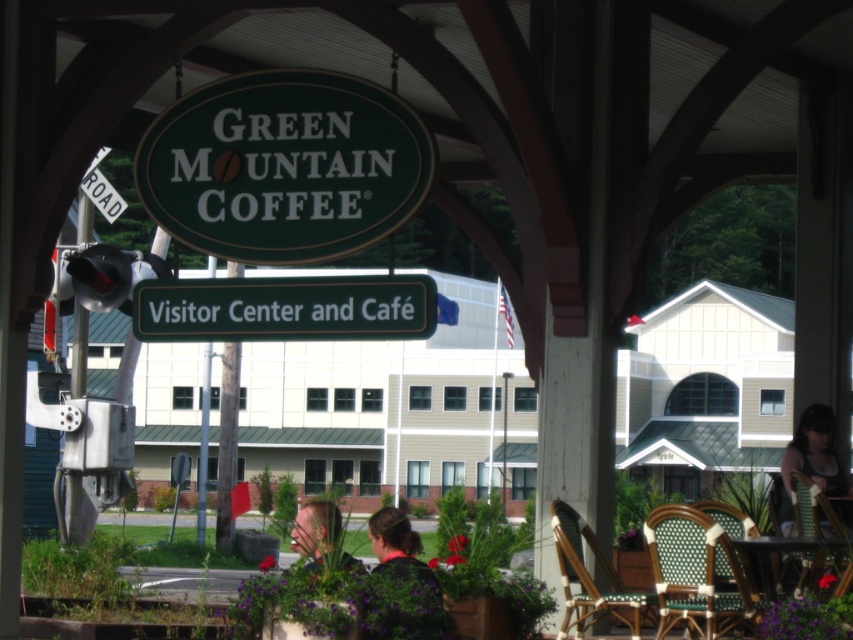
Question: Which of these objects is positioned closest to the dark brown hair at lower center?

Choices:
 (A) green matte signboard at upper center
 (B) blonde hair at center
 (C) green matte sign at center

Answer: (C)

Question: Considering the relative positions of matte black tank top at lower right and wooden table at lower right in the image provided, where is matte black tank top at lower right located with respect to wooden table at lower right?

Choices:
 (A) left
 (B) right

Answer: (B)

Question: Which of the following is the closest to the observer?

Choices:
 (A) blonde hair at center
 (B) wooden table at lower right
 (C) matte black tank top at lower right
 (D) green matte signboard at upper center

Answer: (A)

Question: Can you confirm if matte black tank top at lower right is smaller than wooden table at lower right?

Choices:
 (A) yes
 (B) no

Answer: (B)

Question: Considering the relative positions of matte black tank top at lower right and dark brown hair at lower center in the image provided, where is matte black tank top at lower right located with respect to dark brown hair at lower center?

Choices:
 (A) above
 (B) below

Answer: (A)

Question: Which point appears farthest from the camera in this image?

Choices:
 (A) (833, 470)
 (B) (387, 548)
 (C) (308, 554)
 (D) (282, 147)

Answer: (A)